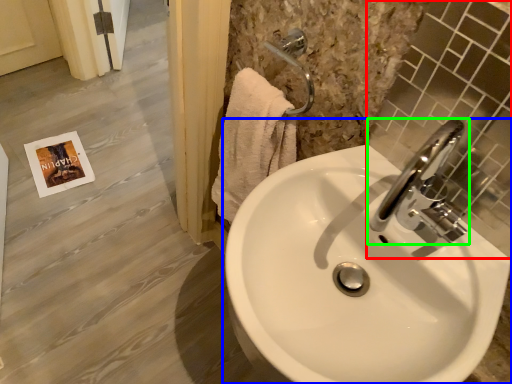
Question: Which object is the farthest from mirror (highlighted by a red box)? Choose among these: sink (highlighted by a blue box) or tap (highlighted by a green box).

Choices:
 (A) sink
 (B) tap

Answer: (A)